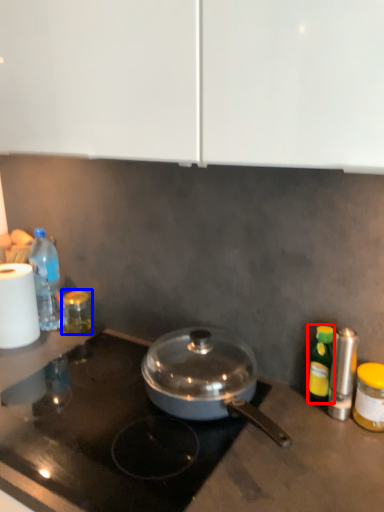
Question: Which point is closer to the camera, bottle (highlighted by a red box) or bottle (highlighted by a blue box)?

Choices:
 (A) bottle
 (B) bottle

Answer: (A)